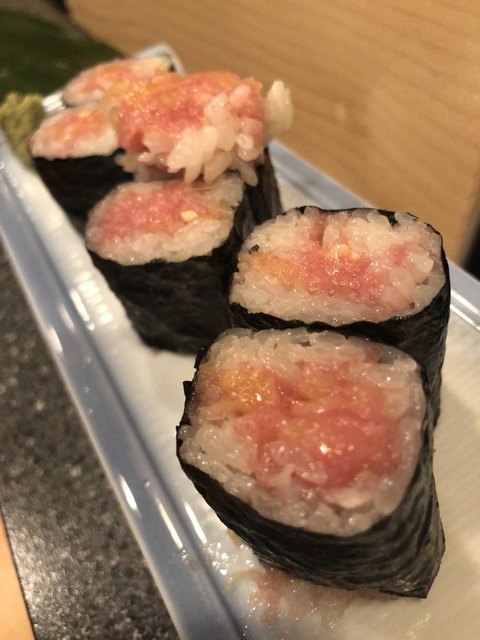
Identify the location of lip of plate. (122, 454), (33, 275), (192, 611), (470, 292), (320, 179), (11, 219).